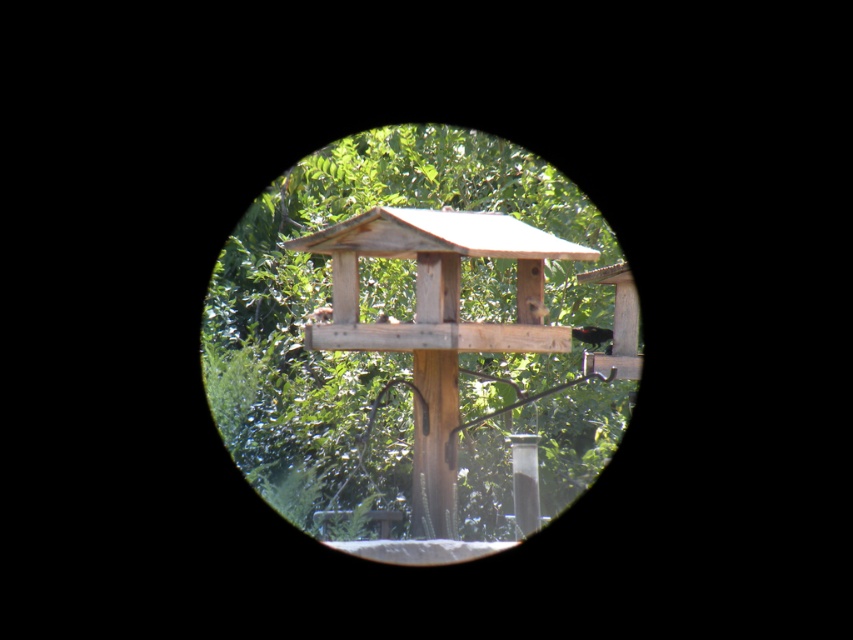
Question: Is the position of shiny black bird at center more distant than that of brown fuzzy bird at center?

Choices:
 (A) yes
 (B) no

Answer: (A)

Question: Which point appears closest to the camera in this image?

Choices:
 (A) (521, 472)
 (B) (387, 314)

Answer: (A)

Question: Considering the real-world distances, which object is closest to the brown fuzzy bird at center?

Choices:
 (A) brown matte bird feeder at center
 (B) clear glass tube at center
 (C) shiny black bird at center
 (D) wooden bird feeder at center

Answer: (A)

Question: Does clear glass tube at center have a lesser width compared to brown fuzzy bird at center?

Choices:
 (A) no
 (B) yes

Answer: (A)

Question: Is the position of wooden bird feeder at center more distant than that of brown matte bird feeder at center?

Choices:
 (A) yes
 (B) no

Answer: (A)

Question: Among these points, which one is farthest from the camera?

Choices:
 (A) (590, 342)
 (B) (527, 440)

Answer: (B)